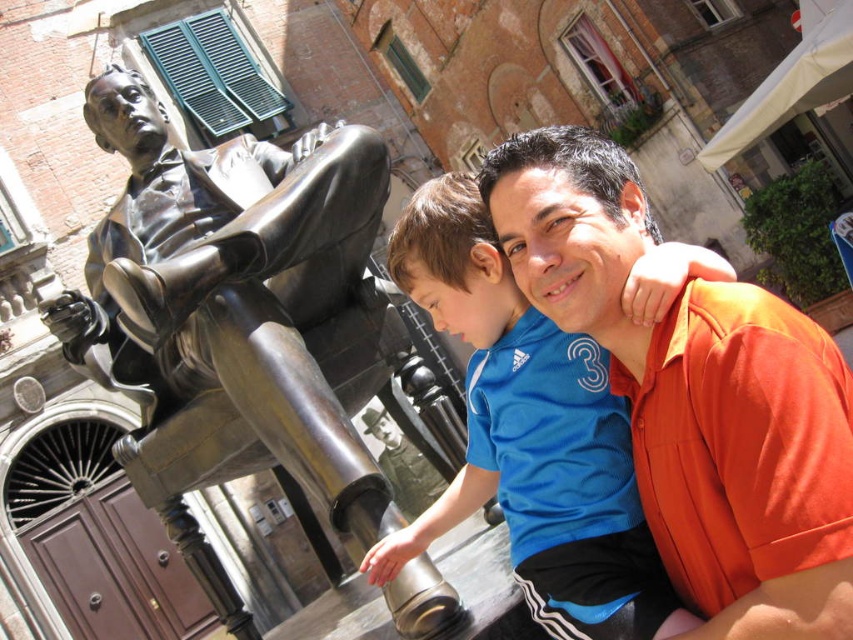
In the scene shown: You are a photographer standing in the street scene and want to take a photo of both the orange cotton shirt at upper right and the blue jersey at center. Which object should you focus on first to ensure both are in frame?

The orange cotton shirt at upper right is much taller than the blue jersey at center, so you should focus on the orange cotton shirt at upper right first to ensure both are in frame.

Consider the image. You are standing at the center of the street and want to take a photo of the bronze statue at left. Which direction should you face to ensure the statue is in the frame?

You should face towards the left direction to capture the bronze statue at left in your photo since it is located at point (236, 310) which is on the left side of the scene.